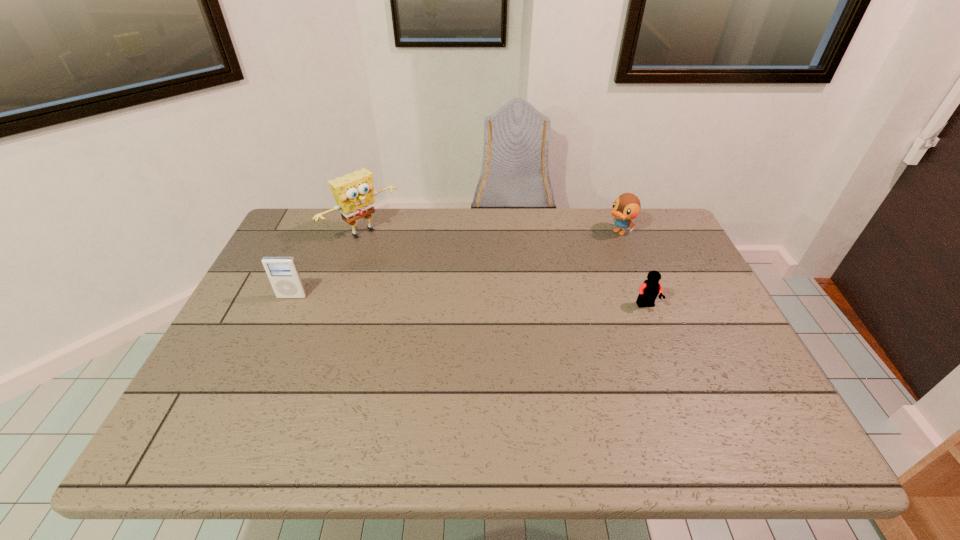
This screenshot has width=960, height=540. I want to click on vacant space on the desktop that is between the second nearest object and the shortest object and is positioned on the face of the sponge, so click(442, 300).

Where is `free space on the desktop that is between the second nearest object and the nearest object and is positioned on the front-facing side of the duck`? The height and width of the screenshot is (540, 960). free space on the desktop that is between the second nearest object and the nearest object and is positioned on the front-facing side of the duck is located at coordinates (518, 302).